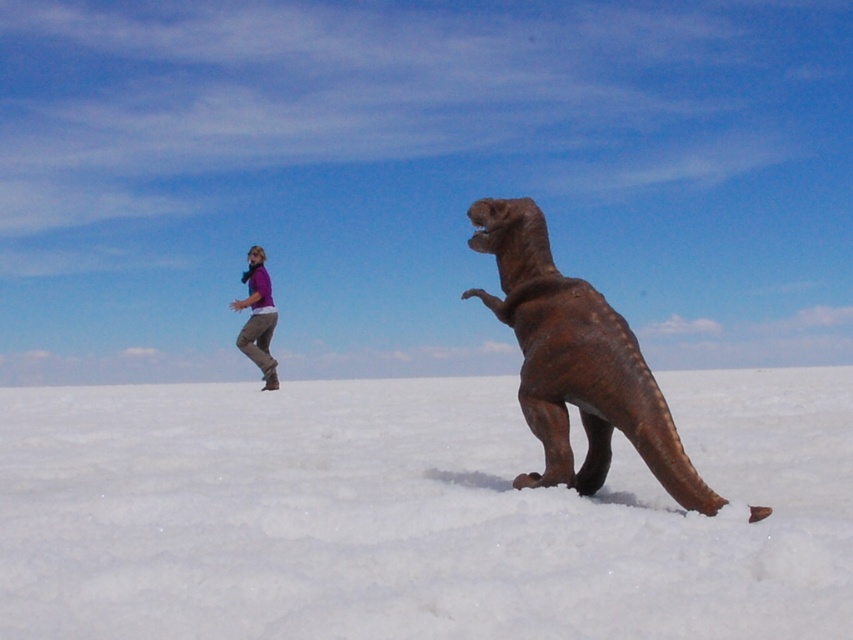
You are a photographer trying to capture the entire scene of the white fluffy snow at center and the purple fabric shirt at upper left in one shot. Based on their sizes, do you think both can fit into your camera frame without cropping?

The white fluffy snow at center might be wider than purple fabric shirt at upper left, so it is possible that both can fit into the camera frame without cropping, but it depends on the exact dimensions and the camera settings.

You are standing at the point with coordinates 0.7, 0.5 in the image. You want to move to the white fluffy snow at center. Which direction should you move to reach it?

The white fluffy snow at center is located at point [415,515]. Since you are at [426,448], you should move northeast to reach it.

You are standing in the snowy field and see the white fluffy snow at center and the purple fabric shirt at upper left. Which object is nearer to you?

The white fluffy snow at center is closer to the viewer than the purple fabric shirt at upper left.